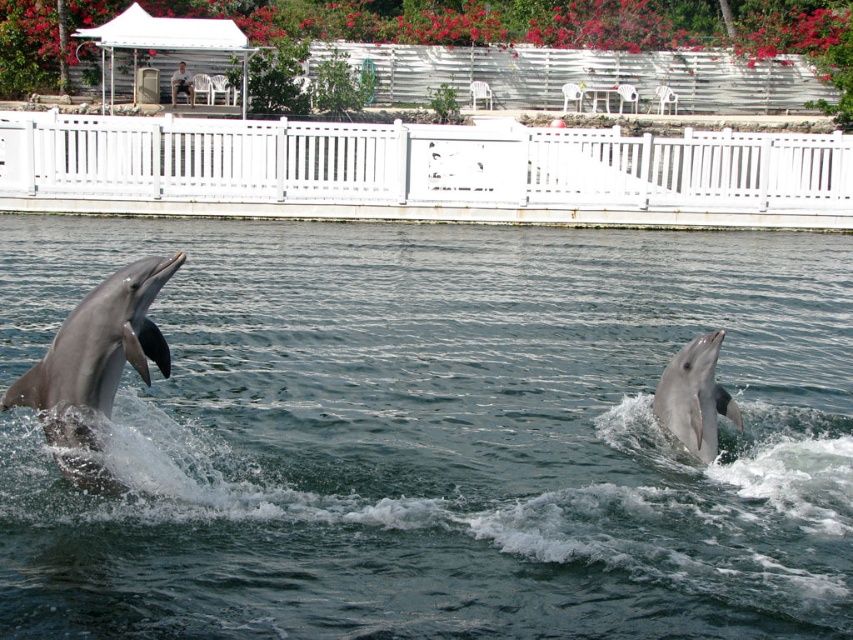
Question: Which point appears closest to the camera in this image?

Choices:
 (A) (183, 67)
 (B) (141, 305)
 (C) (717, 332)
 (D) (643, 349)

Answer: (B)

Question: Among these points, which one is nearest to the camera?

Choices:
 (A) (697, 378)
 (B) (479, 609)

Answer: (B)

Question: In this image, where is clear water at dolphins left located relative to white plastic chair at upper center?

Choices:
 (A) below
 (B) above

Answer: (A)

Question: Which point is closer to the camera?

Choices:
 (A) pos(175,256)
 (B) pos(704,406)
 (C) pos(236,572)

Answer: (A)

Question: Is clear water at dolphins left above white plastic chair at upper center?

Choices:
 (A) yes
 (B) no

Answer: (B)

Question: Observing the image, what is the correct spatial positioning of clear water at dolphins left in reference to white plastic chair at upper center?

Choices:
 (A) below
 (B) above

Answer: (A)